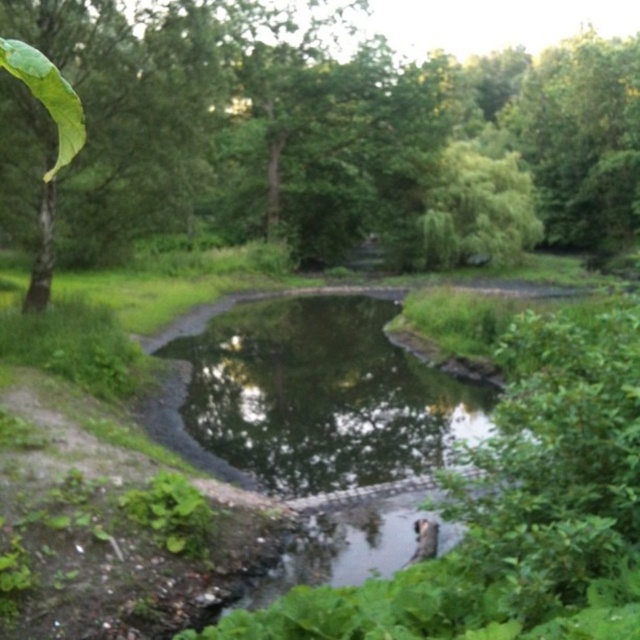
You are standing at the edge of the pond and want to throw a pebble to create a ripple. If you aim for the transparent water at center, how far in meters will the pebble travel before reaching the green leafy tree at upper left?

The green leafy tree at upper left is 14.78 meters from the transparent water at center. Therefore, the pebble will travel 14.78 meters to reach the green leafy tree at upper left.

Based on the scene description, can you determine if the green leafy tree at upper left is wider than the transparent water at center?

The green leafy tree at upper left might be wider than transparent water at center according to the description.

You are standing at the center of the image and want to locate the green leafy tree at upper left. In terms of 2D coordinates, where would you find it?

The green leafy tree at upper left is located at the 2D coordinates of point (250, 131).